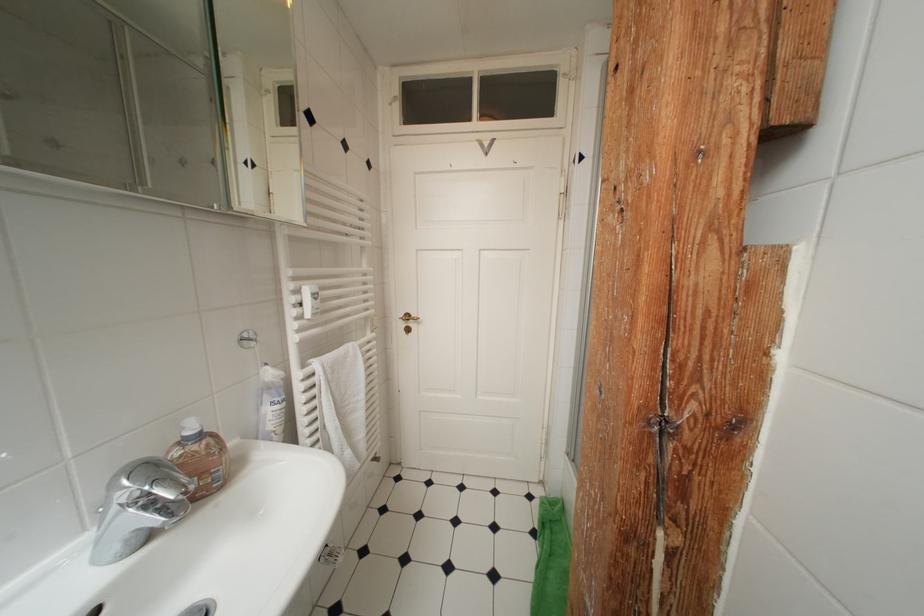
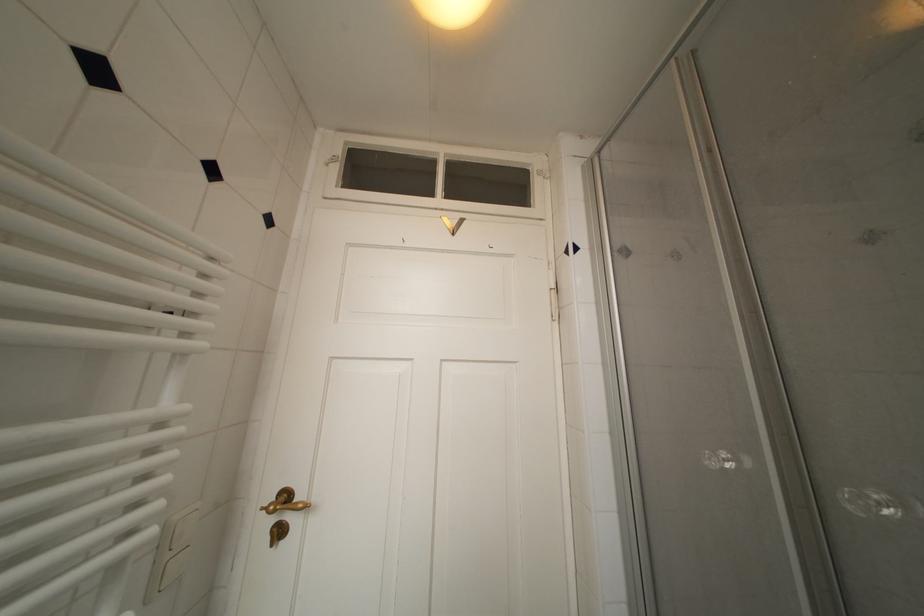
In the second image, find the point that corresponds to [415,320] in the first image.

(293, 500)